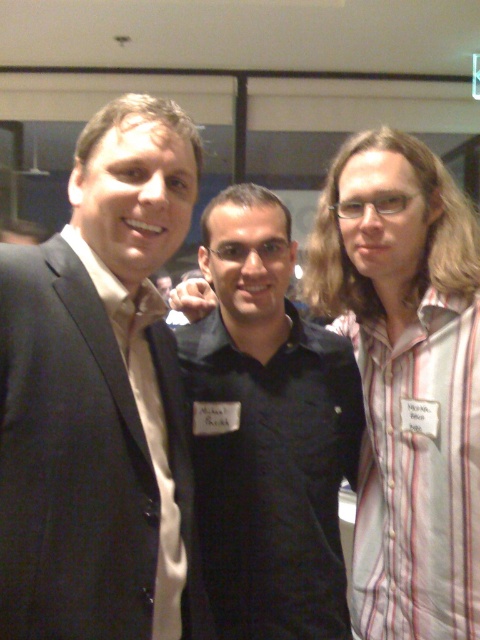
Which is in front, point (4, 492) or point (163, 588)?

Point (4, 492)

Between matte black suit at left and matte gold tie at left, which one has less height?

With less height is matte gold tie at left.

Locate an element on the screen. The width and height of the screenshot is (480, 640). matte black suit at left is located at coordinates (98, 394).

The height and width of the screenshot is (640, 480). I want to click on matte black suit at left, so click(98, 394).

Does matte black suit at left appear over black matte shirt at center?

Yes, matte black suit at left is above black matte shirt at center.

Can you confirm if matte black suit at left is positioned to the right of black matte shirt at center?

Incorrect, matte black suit at left is not on the right side of black matte shirt at center.

The height and width of the screenshot is (640, 480). I want to click on matte black suit at left, so pyautogui.click(x=98, y=394).

Is black matte shirt at center shorter than matte gold tie at left?

No.

What do you see at coordinates (267, 432) in the screenshot? I see `black matte shirt at center` at bounding box center [267, 432].

Is point (331, 477) farther from viewer compared to point (145, 413)?

Yes, it is behind point (145, 413).

You are a GUI agent. You are given a task and a screenshot of the screen. Output one action in this format:
    pyautogui.click(x=<x>, y=<y>)
    Task: Click on the black matte shirt at center
    
    Given the screenshot: What is the action you would take?
    pyautogui.click(x=267, y=432)